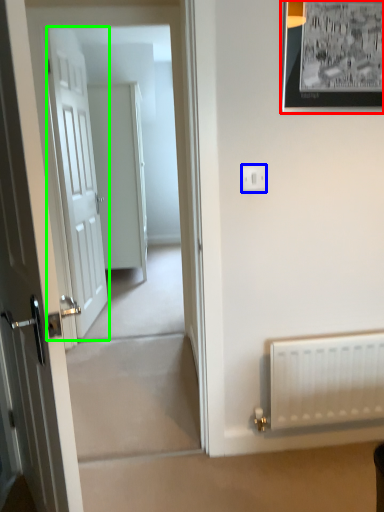
Question: Estimate the real-world distances between objects in this image. Which object is farther from picture frame (highlighted by a red box), electric outlet (highlighted by a blue box) or door (highlighted by a green box)?

Choices:
 (A) electric outlet
 (B) door

Answer: (B)